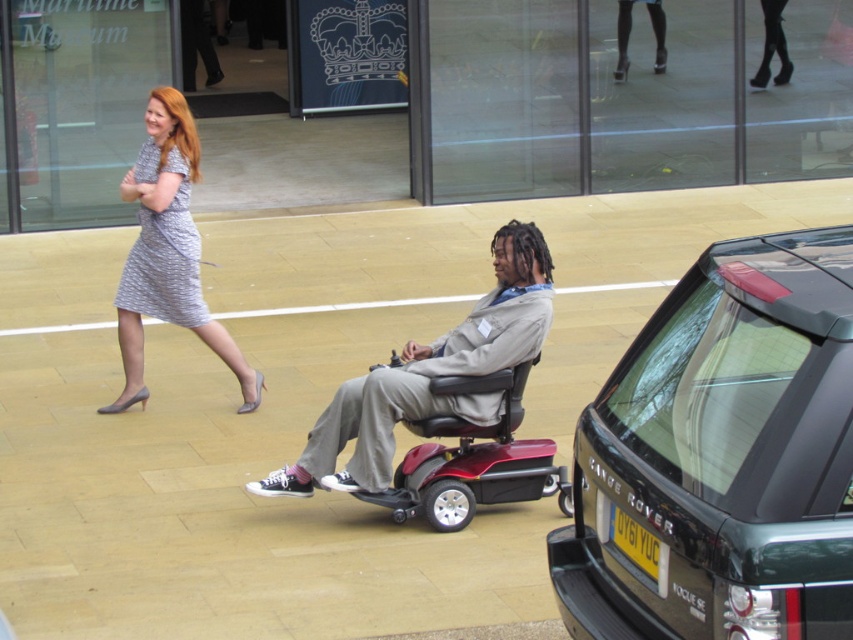
Question: Observing the image, what is the correct spatial positioning of dark gray metallic range rover at center right in reference to yellow matte license plate at lower right?

Choices:
 (A) below
 (B) above

Answer: (B)

Question: Which object is the farthest from the yellow matte license plate at lower right?

Choices:
 (A) metallic red mobility scooter at center
 (B) gray fabric wheelchair at center

Answer: (B)

Question: Estimate the real-world distances between objects in this image. Which object is closer to the gray fabric wheelchair at center?

Choices:
 (A) yellow matte license plate at lower right
 (B) metallic red mobility scooter at center

Answer: (B)

Question: Which of these objects is positioned closest to the gray printed dress at left?

Choices:
 (A) metallic red mobility scooter at center
 (B) gray fabric wheelchair at center
 (C) yellow matte license plate at lower right
 (D) dark gray metallic range rover at center right

Answer: (B)

Question: Where is gray fabric wheelchair at center located in relation to gray printed dress at left in the image?

Choices:
 (A) right
 (B) left

Answer: (A)

Question: Is gray fabric wheelchair at center to the right of yellow matte license plate at lower right from the viewer's perspective?

Choices:
 (A) yes
 (B) no

Answer: (B)